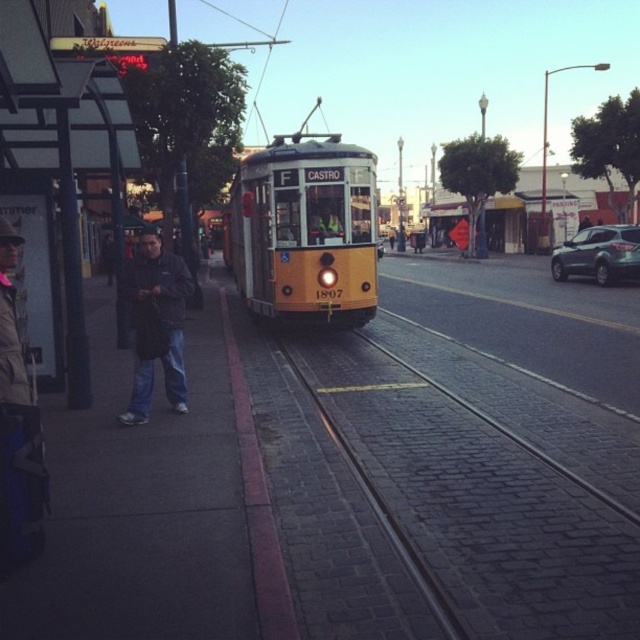
Question: Considering the real-world distances, which object is farthest from the brick paved train track at center?

Choices:
 (A) dark blue jacket at left
 (B) denim jacket at left
 (C) green matte suv at right
 (D) dark gray jacket at left

Answer: (D)

Question: Which point is closer to the camera?

Choices:
 (A) denim jacket at left
 (B) green matte suv at right
 (C) dark gray jacket at left
 (D) brick paved train track at center

Answer: (D)

Question: Observing the image, what is the correct spatial positioning of dark blue jacket at left in reference to green matte suv at right?

Choices:
 (A) above
 (B) below

Answer: (B)

Question: Can you confirm if brick paved train track at center is positioned above denim jacket at left?

Choices:
 (A) no
 (B) yes

Answer: (A)

Question: Does brick paved train track at center appear over green matte suv at right?

Choices:
 (A) yes
 (B) no

Answer: (B)

Question: Estimate the real-world distances between objects in this image. Which object is farther from the dark gray jacket at left?

Choices:
 (A) denim jacket at left
 (B) green matte suv at right
 (C) brick paved train track at center
 (D) dark blue jacket at left

Answer: (D)